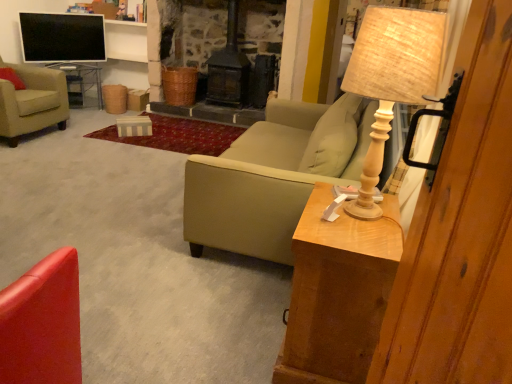
Question: Is beige fabric armchair at left, placed as the first chair when sorted from left to right, positioned behind shiny red chair at lower left, marked as the first chair in a front-to-back arrangement?

Choices:
 (A) yes
 (B) no

Answer: (A)

Question: Is beige fabric armchair at left, placed as the first chair when sorted from left to right, turned away from shiny red chair at lower left, marked as the first chair in a front-to-back arrangement?

Choices:
 (A) no
 (B) yes

Answer: (A)

Question: From the image's perspective, is beige fabric armchair at left, marked as the second chair in a right-to-left arrangement, on shiny red chair at lower left, placed as the 2th chair when sorted from top to bottom?

Choices:
 (A) yes
 (B) no

Answer: (A)

Question: Considering the relative sizes of beige fabric armchair at left, which is the first chair from top to bottom, and shiny red chair at lower left, which is counted as the 2th chair, starting from the left, in the image provided, is beige fabric armchair at left, which is the first chair from top to bottom, wider than shiny red chair at lower left, which is counted as the 2th chair, starting from the left,?

Choices:
 (A) yes
 (B) no

Answer: (A)

Question: Is beige fabric armchair at left, placed as the first chair when sorted from left to right, surrounding shiny red chair at lower left, which is counted as the 2th chair, starting from the left?

Choices:
 (A) no
 (B) yes

Answer: (A)

Question: Is beige fabric armchair at left, positioned as the first chair in back-to-front order, to the left or to the right of flat screen tv at upper left in the image?

Choices:
 (A) left
 (B) right

Answer: (A)

Question: From a real-world perspective, relative to flat screen tv at upper left, is beige fabric armchair at left, positioned as the first chair in back-to-front order, vertically above or below?

Choices:
 (A) below
 (B) above

Answer: (A)

Question: Is point (34, 112) positioned closer to the camera than point (20, 31)?

Choices:
 (A) closer
 (B) farther

Answer: (A)

Question: Considering the positions of beige fabric armchair at left, marked as the second chair in a right-to-left arrangement, and flat screen tv at upper left in the image, is beige fabric armchair at left, marked as the second chair in a right-to-left arrangement, taller or shorter than flat screen tv at upper left?

Choices:
 (A) short
 (B) tall

Answer: (B)

Question: Is beige fabric armchair at left, which is the first chair from top to bottom, to the left or to the right of shiny red chair at lower left, placed as the 2th chair when sorted from top to bottom, in the image?

Choices:
 (A) right
 (B) left

Answer: (B)

Question: Is beige fabric armchair at left, the 2th chair when ordered from front to back, spatially inside shiny red chair at lower left, positioned as the second chair in back-to-front order, or outside of it?

Choices:
 (A) outside
 (B) inside

Answer: (A)

Question: Is beige fabric armchair at left, placed as the second chair when sorted from bottom to top, in front of or behind shiny red chair at lower left, positioned as the second chair in back-to-front order, in the image?

Choices:
 (A) front
 (B) behind

Answer: (B)

Question: From a real-world perspective, is beige fabric armchair at left, placed as the first chair when sorted from left to right, above or below shiny red chair at lower left, positioned as the second chair in back-to-front order?

Choices:
 (A) below
 (B) above

Answer: (A)

Question: From a real-world perspective, is wooden beige table lamp at right physically located above or below shiny red chair at lower left, the first chair in the right-to-left sequence?

Choices:
 (A) above
 (B) below

Answer: (A)

Question: Is wooden beige table lamp at right to the left or to the right of shiny red chair at lower left, the first chair when ordered from bottom to top, in the image?

Choices:
 (A) right
 (B) left

Answer: (A)